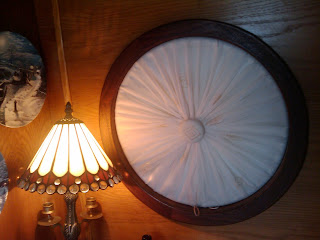
Find the location of `window blinds`. window blinds is located at coordinates (182, 123).